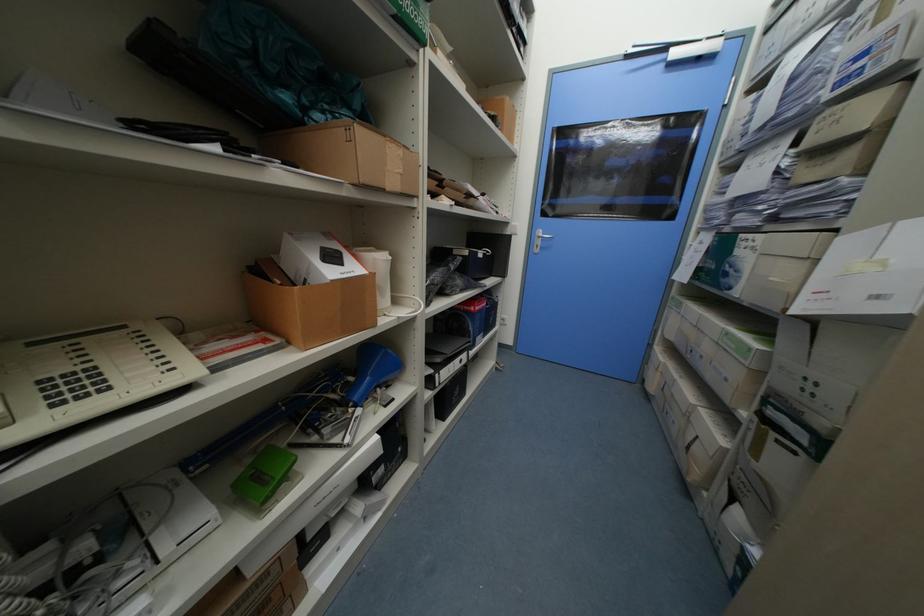
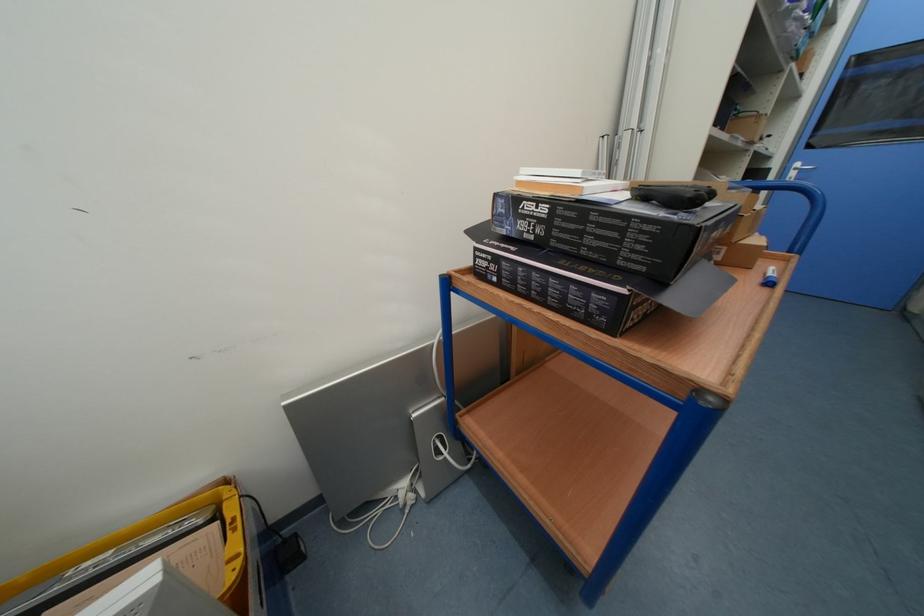
Which direction would the cameraman need to move to produce the second image?

The cameraman walked toward left, backward.